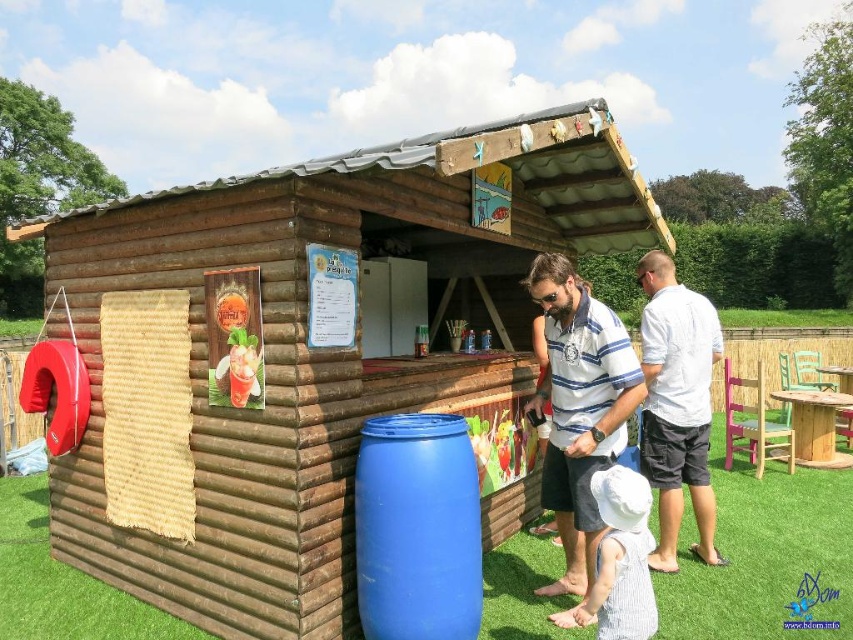
You are a delivery person carrying a box that is 1.2 meters wide. You need to place it between the brown wooden log cabin at center and the blue plastic barrel at center. Is there enough space to fit the box between them?

The distance between the brown wooden log cabin at center and the blue plastic barrel at center is 1.04 meters. Since the box is 1.2 meters wide, it is wider than the available space. Therefore, the box cannot fit between them.

You are a customer standing at the entrance of the rustic wooden bar. You want to hand a folded note to someone behind the counter. The note is too fragile to crumple, so you need to slide it across the counter without bending. The counter is 1.2 meters wide. Can you slide the note from the white cotton shirt at right to the white striped dress at lower center without it bending?

The distance between the white cotton shirt at right and the white striped dress at lower center is 1.38 meters. Since the counter is only 1.2 meters wide, the note would extend beyond the counter if slid from one to the other, causing it to bend. Therefore, you cannot slide the note without bending it.